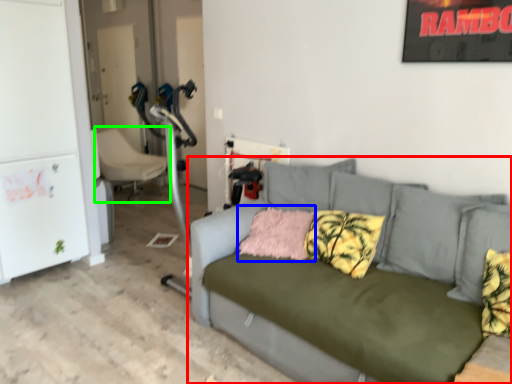
Question: Estimate the real-world distances between objects in this image. Which object is farther from studio couch (highlighted by a red box), pillow (highlighted by a blue box) or chair (highlighted by a green box)?

Choices:
 (A) pillow
 (B) chair

Answer: (B)